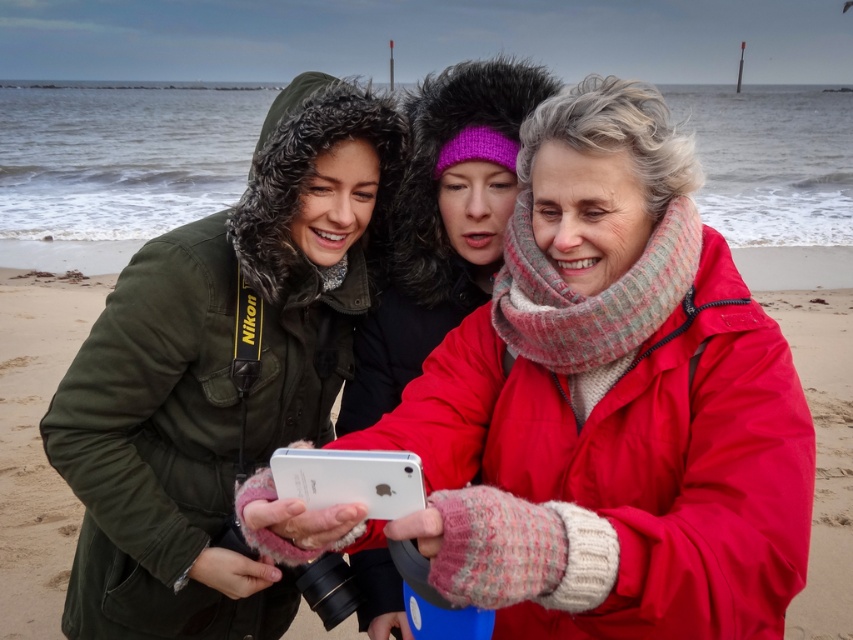
Question: Can you confirm if matte black jacket at left is bigger than knitted pink scarf at center?

Choices:
 (A) yes
 (B) no

Answer: (A)

Question: Does matte black jacket at left appear under white matte smartphone at center?

Choices:
 (A) no
 (B) yes

Answer: (A)

Question: Estimate the real-world distances between objects in this image. Which object is farther from the matte black jacket at left?

Choices:
 (A) white matte smartphone at center
 (B) knitted pink scarf at center

Answer: (A)

Question: Which of the following is the closest to the observer?

Choices:
 (A) white matte smartphone at center
 (B) sandy beach at center
 (C) knitted pink scarf at center
 (D) matte black jacket at left

Answer: (A)

Question: Can you confirm if matte black jacket at left is positioned to the left of knitted pink scarf at center?

Choices:
 (A) yes
 (B) no

Answer: (A)

Question: Which object is farther from the camera taking this photo?

Choices:
 (A) matte black jacket at left
 (B) white matte smartphone at center

Answer: (A)